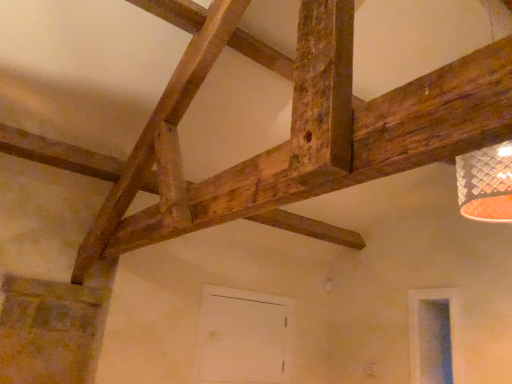
Question: In terms of size, does transparent glass window at lower right appear bigger or smaller than white matte door at center?

Choices:
 (A) big
 (B) small

Answer: (B)

Question: Does point (440, 327) appear closer or farther from the camera than point (206, 347)?

Choices:
 (A) farther
 (B) closer

Answer: (A)

Question: Is transparent glass window at lower right wider or thinner than white matte door at center?

Choices:
 (A) wide
 (B) thin

Answer: (B)

Question: Considering the positions of white matte door at center and transparent glass window at lower right in the image, is white matte door at center wider or thinner than transparent glass window at lower right?

Choices:
 (A) thin
 (B) wide

Answer: (B)

Question: Considering the positions of point (241, 304) and point (423, 360), is point (241, 304) closer or farther from the camera than point (423, 360)?

Choices:
 (A) farther
 (B) closer

Answer: (A)

Question: Is white matte door at center situated inside transparent glass window at lower right or outside?

Choices:
 (A) inside
 (B) outside

Answer: (B)

Question: In terms of size, does white matte door at center appear bigger or smaller than transparent glass window at lower right?

Choices:
 (A) big
 (B) small

Answer: (A)